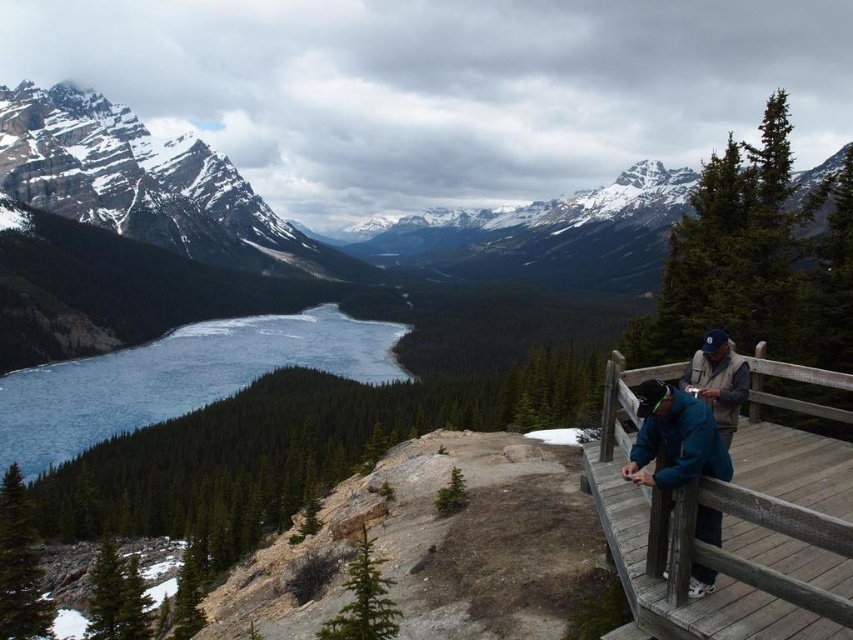
Question: Among these points, which one is farthest from the camera?

Choices:
 (A) (666, 458)
 (B) (96, 390)
 (C) (726, 484)

Answer: (B)

Question: Does blue fabric jacket at right appear on the right side of blue denim jacket at upper right?

Choices:
 (A) no
 (B) yes

Answer: (A)

Question: Is wooden at right to the left of blue fabric jacket at right from the viewer's perspective?

Choices:
 (A) yes
 (B) no

Answer: (B)

Question: Can you confirm if blue fabric jacket at right is positioned to the left of blue denim jacket at upper right?

Choices:
 (A) no
 (B) yes

Answer: (B)

Question: Which of the following is the farthest from the observer?

Choices:
 (A) (740, 371)
 (B) (804, 525)
 (C) (44, 461)
 (D) (732, 417)

Answer: (C)

Question: Estimate the real-world distances between objects in this image. Which object is closer to the blue ice at lower left?

Choices:
 (A) blue fabric jacket at right
 (B) blue denim jacket at upper right

Answer: (B)